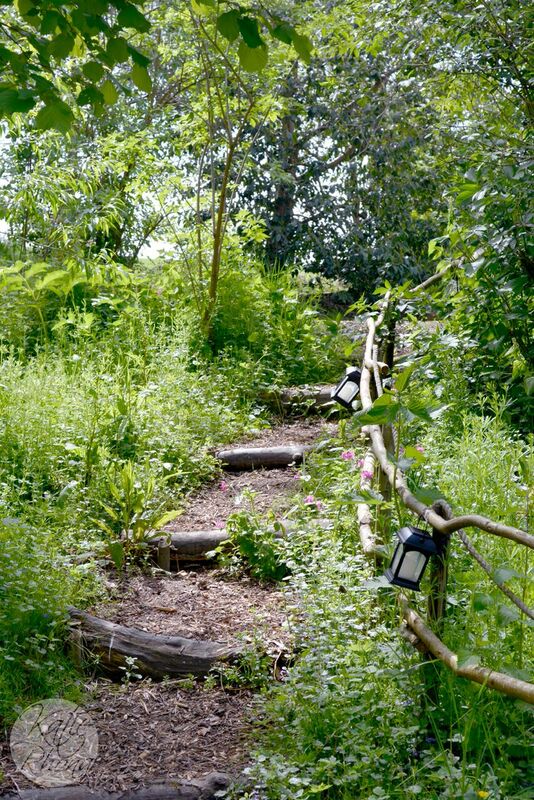
Locate an element on the screen. lamps is located at coordinates (411, 564), (347, 390).